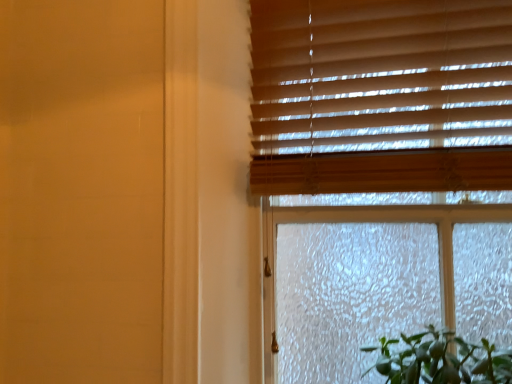
Question: Is wooden blinds at upper right bigger or smaller than wooden blinds at upper right?

Choices:
 (A) big
 (B) small

Answer: (B)

Question: Considering the relative positions of wooden blinds at upper right and wooden blinds at upper right in the image provided, is wooden blinds at upper right to the left or to the right of wooden blinds at upper right?

Choices:
 (A) right
 (B) left

Answer: (A)

Question: Is wooden blinds at upper right inside or outside of wooden blinds at upper right?

Choices:
 (A) inside
 (B) outside

Answer: (A)

Question: In the image, is wooden blinds at upper right on the left side or the right side of wooden blinds at upper right?

Choices:
 (A) right
 (B) left

Answer: (B)

Question: In terms of width, does wooden blinds at upper right look wider or thinner when compared to wooden blinds at upper right?

Choices:
 (A) wide
 (B) thin

Answer: (A)

Question: In the image, is wooden blinds at upper right positioned in front of or behind wooden blinds at upper right?

Choices:
 (A) front
 (B) behind

Answer: (A)

Question: From a real-world perspective, relative to wooden blinds at upper right, is wooden blinds at upper right vertically above or below?

Choices:
 (A) below
 (B) above

Answer: (A)